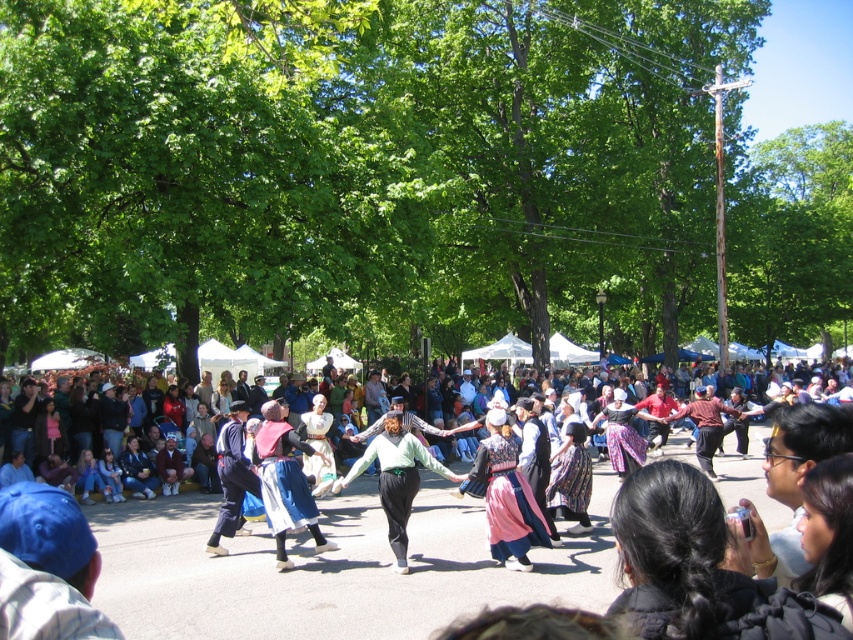
Question: Which of the following is the closest to the observer?

Choices:
 (A) (395, 509)
 (B) (527, 532)
 (C) (289, 515)

Answer: (A)

Question: Does green fabric skirt at center have a lesser width compared to multicolored fabric crowd at center?

Choices:
 (A) yes
 (B) no

Answer: (A)

Question: Which point is farther from the camera taking this photo?

Choices:
 (A) (726, 465)
 (B) (399, 496)

Answer: (A)

Question: Which point appears closest to the camera in this image?

Choices:
 (A) (520, 484)
 (B) (271, 416)
 (C) (753, 468)

Answer: (A)

Question: Is matte blue skirt at center positioned in front of green fabric skirt at center?

Choices:
 (A) yes
 (B) no

Answer: (B)

Question: Can you confirm if silk skirt at center is smaller than matte blue skirt at center?

Choices:
 (A) no
 (B) yes

Answer: (B)